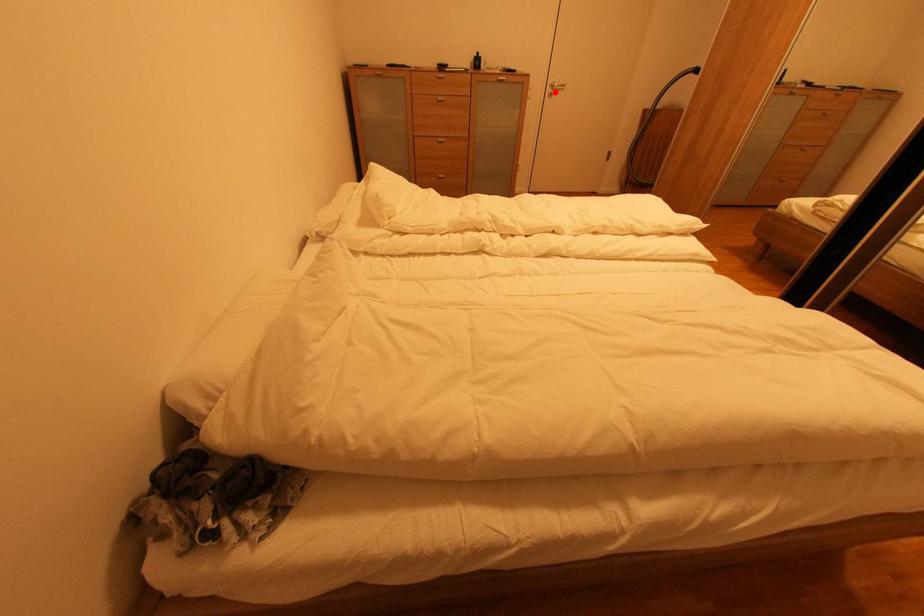
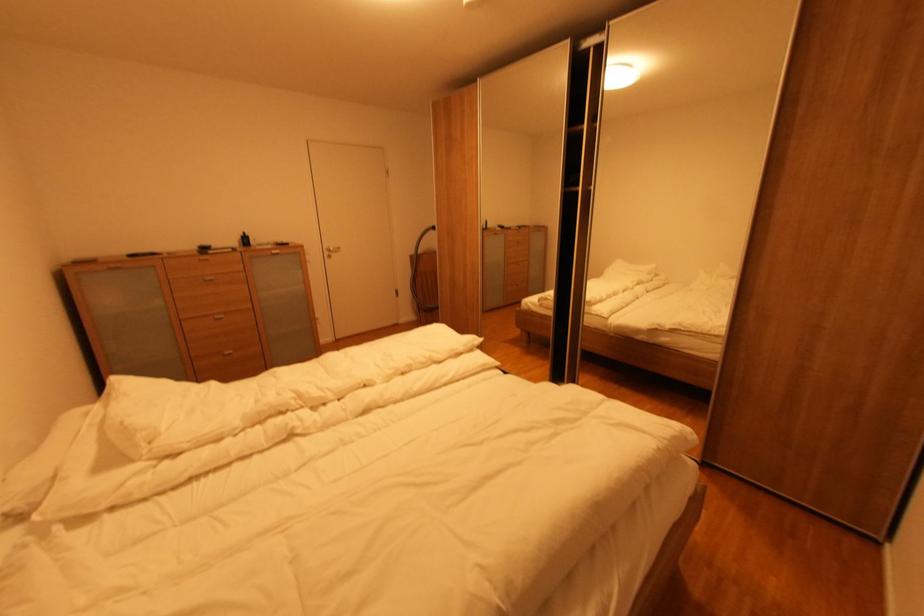
Question: I am providing you with two images of the same scene from different viewpoints. Given a red point in image1, look at the same physical point in image2. Is it:

Choices:
 (A) Closer to the viewpoint
 (B) Farther from the viewpoint

Answer: (B)